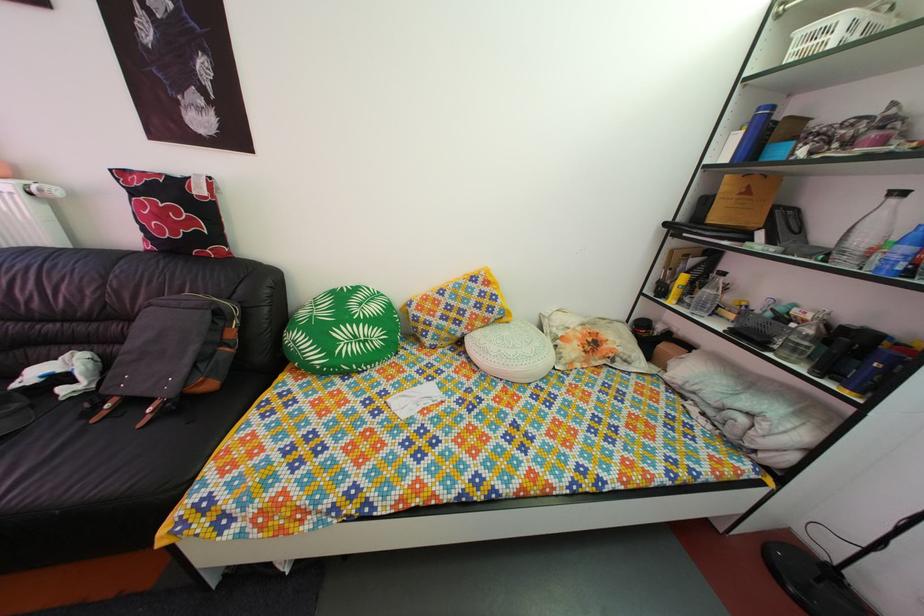
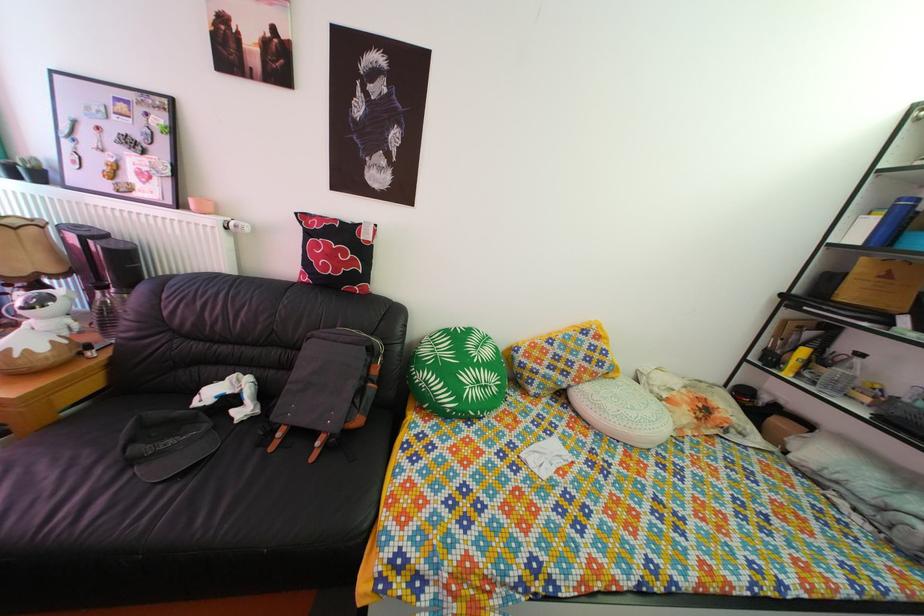
Question: The images are taken continuously from a first-person perspective. In which direction are you moving?

Choices:
 (A) Left
 (B) Right
 (C) Forward
 (D) Backward

Answer: (A)